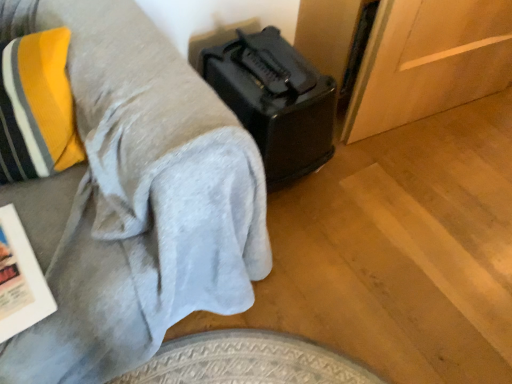
Question: Is there a large distance between black plastic toaster at upper right and white paper magazine at lower left?

Choices:
 (A) no
 (B) yes

Answer: (A)

Question: Considering the relative positions of black plastic toaster at upper right and white paper magazine at lower left in the image provided, is black plastic toaster at upper right in front of white paper magazine at lower left?

Choices:
 (A) yes
 (B) no

Answer: (A)

Question: Does black plastic toaster at upper right appear on the left side of white paper magazine at lower left?

Choices:
 (A) no
 (B) yes

Answer: (A)

Question: From a real-world perspective, is black plastic toaster at upper right on white paper magazine at lower left?

Choices:
 (A) yes
 (B) no

Answer: (B)

Question: From the image's perspective, would you say black plastic toaster at upper right is shown under white paper magazine at lower left?

Choices:
 (A) no
 (B) yes

Answer: (A)

Question: Considering the positions of point (302, 61) and point (167, 274), is point (302, 61) closer or farther from the camera than point (167, 274)?

Choices:
 (A) closer
 (B) farther

Answer: (B)

Question: From the image's perspective, is black plastic suitcase at lower right located above or below black plastic toaster at upper right?

Choices:
 (A) above
 (B) below

Answer: (A)

Question: Based on their sizes in the image, would you say black plastic suitcase at lower right is bigger or smaller than black plastic toaster at upper right?

Choices:
 (A) big
 (B) small

Answer: (B)

Question: Is black plastic suitcase at lower right inside or outside of black plastic toaster at upper right?

Choices:
 (A) outside
 (B) inside

Answer: (A)

Question: Which is correct: white paper magazine at lower left is inside black plastic toaster at upper right, or outside of it?

Choices:
 (A) inside
 (B) outside

Answer: (A)

Question: In terms of width, does white paper magazine at lower left look wider or thinner when compared to black plastic toaster at upper right?

Choices:
 (A) wide
 (B) thin

Answer: (B)

Question: From the image's perspective, relative to black plastic toaster at upper right, is white paper magazine at lower left above or below?

Choices:
 (A) below
 (B) above

Answer: (A)

Question: Looking at the image, does white paper magazine at lower left seem bigger or smaller compared to black plastic toaster at upper right?

Choices:
 (A) big
 (B) small

Answer: (B)

Question: From a real-world perspective, relative to white paper magazine at lower left, is black plastic suitcase at lower right vertically above or below?

Choices:
 (A) below
 (B) above

Answer: (A)

Question: From the image's perspective, is black plastic suitcase at lower right located above or below white paper magazine at lower left?

Choices:
 (A) above
 (B) below

Answer: (A)